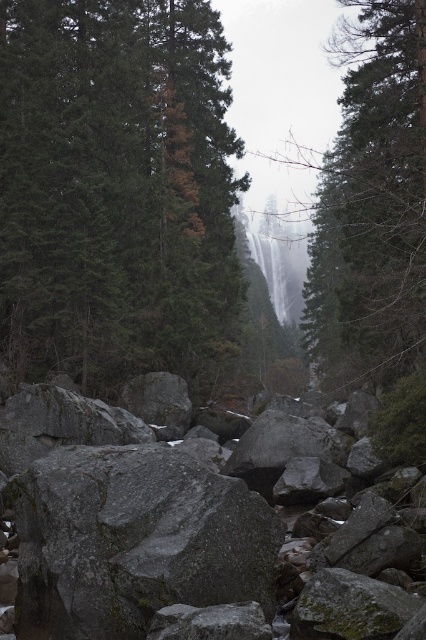
You are standing in the natural scene and want to place a small potted plant between the gray granite rocks at lower center and the gray rough rock at center. Based on their positions, which rock should the plant be closer to?

The gray granite rocks at lower center is positioned on the left side of gray rough rock at center, so the plant should be placed closer to the gray granite rocks at lower center to be between them.

You are a hiker standing at the base of the gray granite rocks at lower center. You want to climb to the top of the green matte tree at upper center. Considering their sizes, which one do you think is easier to reach?

The gray granite rocks at lower center has a smaller size compared to the green matte tree at upper center, so it might be easier to reach the gray granite rocks at lower center first before attempting to climb the larger tree.

You are a geologist examining the gray granite rocks at lower center and the gray rough rock at center in the image. Which of these two rocks do you think has a greater surface area?

The gray granite rocks at lower center is larger in size than the gray rough rock at center, so it likely has a greater surface area.